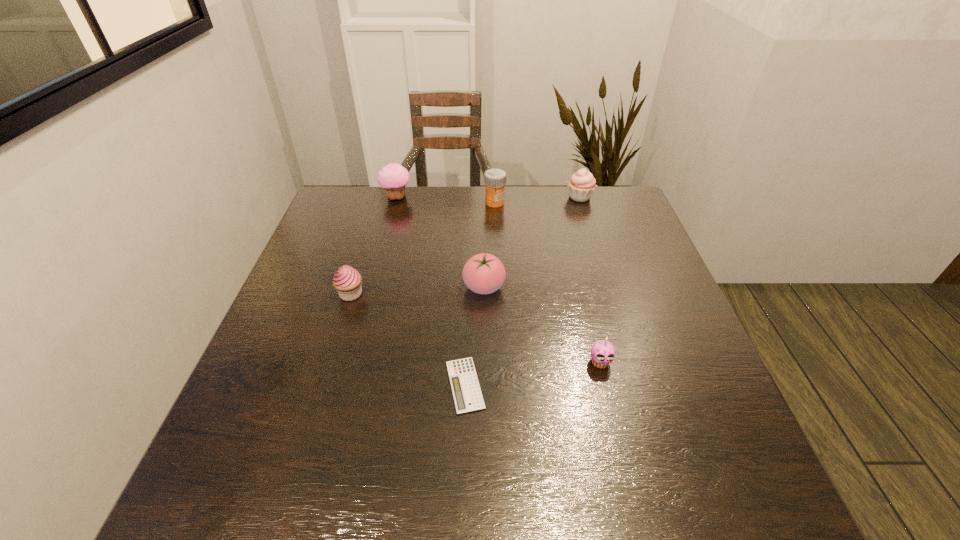
In the image, there is a desktop. Where is `vacant space at the near left corner`? The width and height of the screenshot is (960, 540). vacant space at the near left corner is located at coordinates (205, 504).

This screenshot has width=960, height=540. I want to click on vacant space at the far right corner of the desktop, so click(618, 198).

Locate an element on the screen. The image size is (960, 540). free space at the near right corner of the desktop is located at coordinates (695, 464).

The height and width of the screenshot is (540, 960). In order to click on empty space that is in between the tomato and the shortest object in this screenshot , I will do `click(474, 336)`.

I want to click on vacant space that is in between the second nearest cupcake and the calculator, so (x=408, y=340).

The height and width of the screenshot is (540, 960). I want to click on free space between the medicine and the shortest cupcake, so click(x=547, y=282).

Where is `vacant space that's between the tomato and the calculator`? Image resolution: width=960 pixels, height=540 pixels. vacant space that's between the tomato and the calculator is located at coordinates (474, 336).

At what (x,y) coordinates should I click in order to perform the action: click on free space that is in between the second nearest cupcake and the calculator. Please return your answer as a coordinate pair (x, y). Looking at the image, I should click on (408, 340).

Where is `empty space between the third farthest cupcake and the medicine`? This screenshot has width=960, height=540. empty space between the third farthest cupcake and the medicine is located at coordinates (422, 248).

Where is `object that is the third closest to the sixth tallest object`? The image size is (960, 540). object that is the third closest to the sixth tallest object is located at coordinates (347, 281).